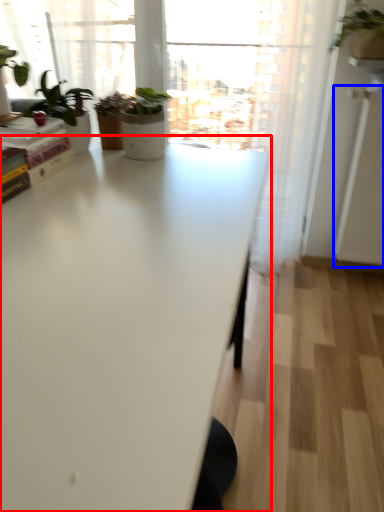
Question: Which object appears closest to the camera in this image, table (highlighted by a red box) or screen door (highlighted by a blue box)?

Choices:
 (A) table
 (B) screen door

Answer: (A)